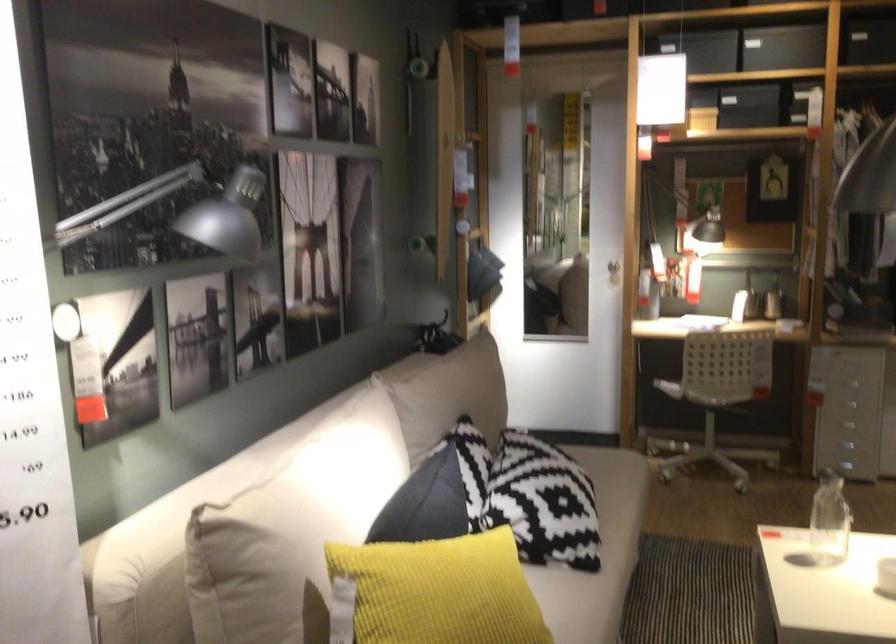
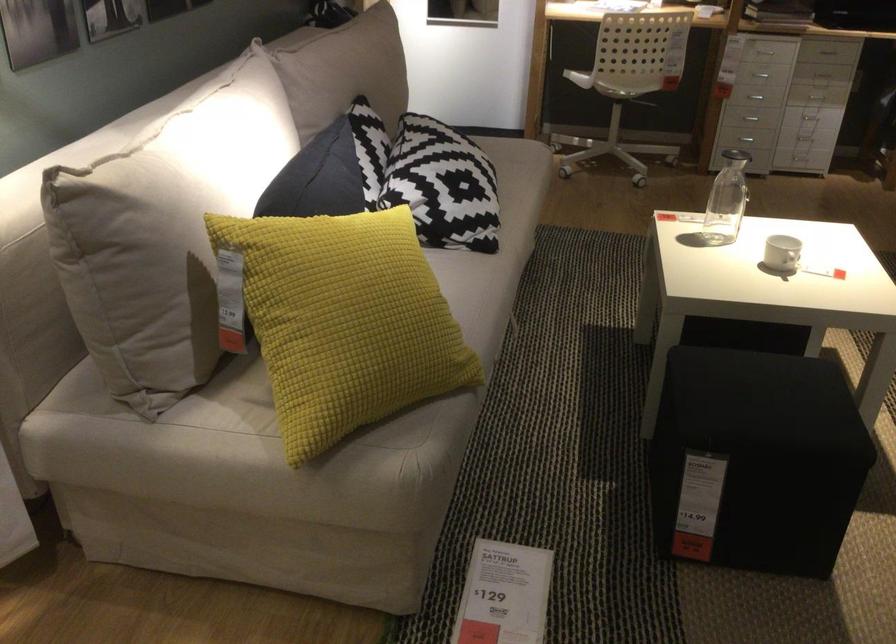
In the second image, find the point that corresponds to [728,384] in the first image.

(627, 80)